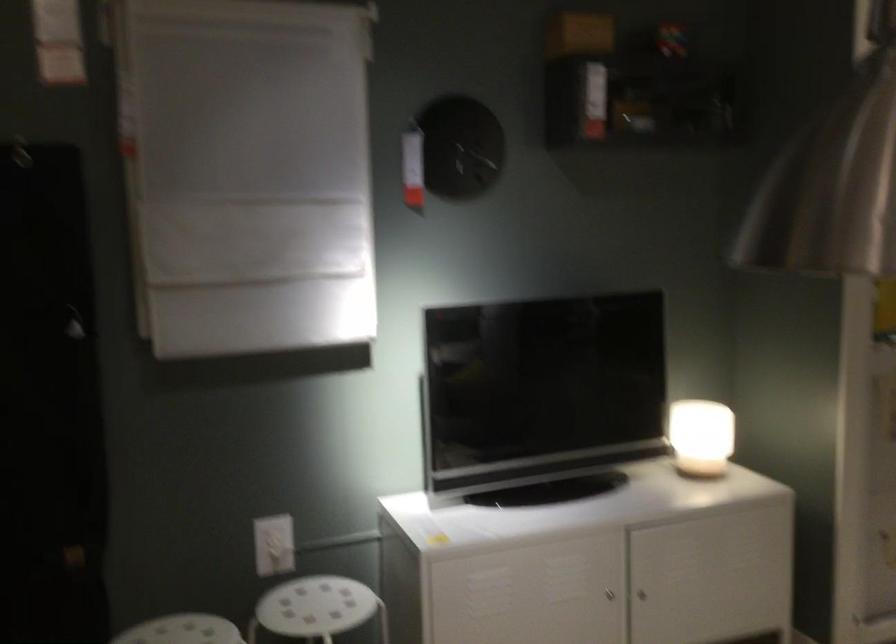
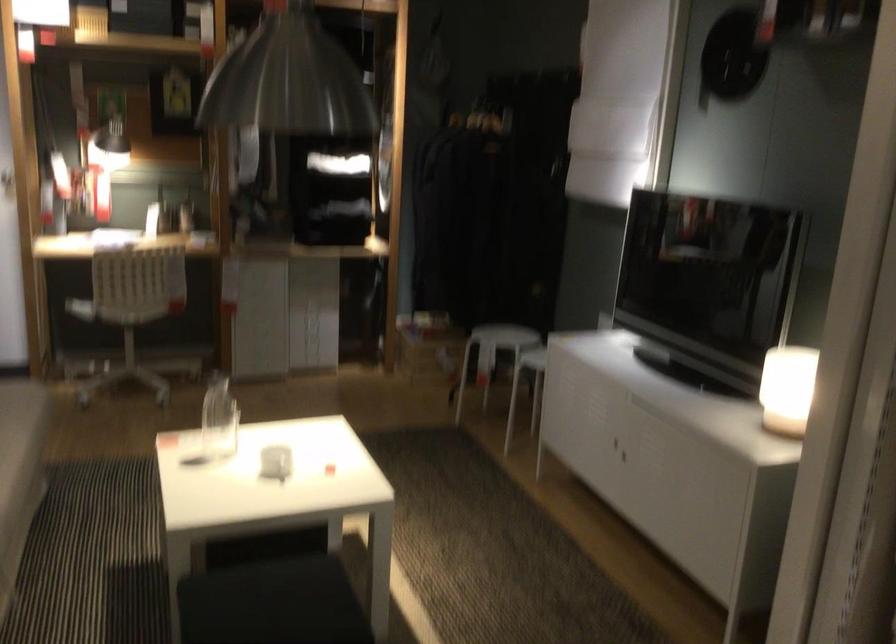
In the second image, find the point that corresponds to (x=728, y=431) in the first image.

(788, 380)